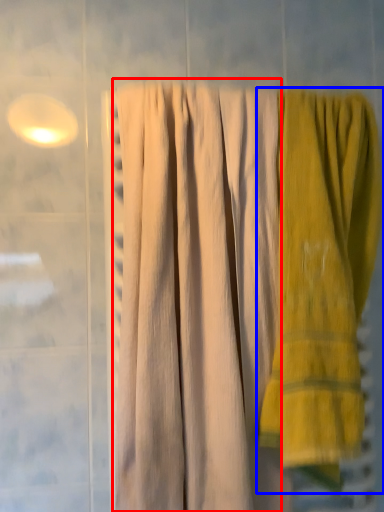
Question: Which object is closer to the camera taking this photo, curtain (highlighted by a red box) or towel (highlighted by a blue box)?

Choices:
 (A) curtain
 (B) towel

Answer: (A)